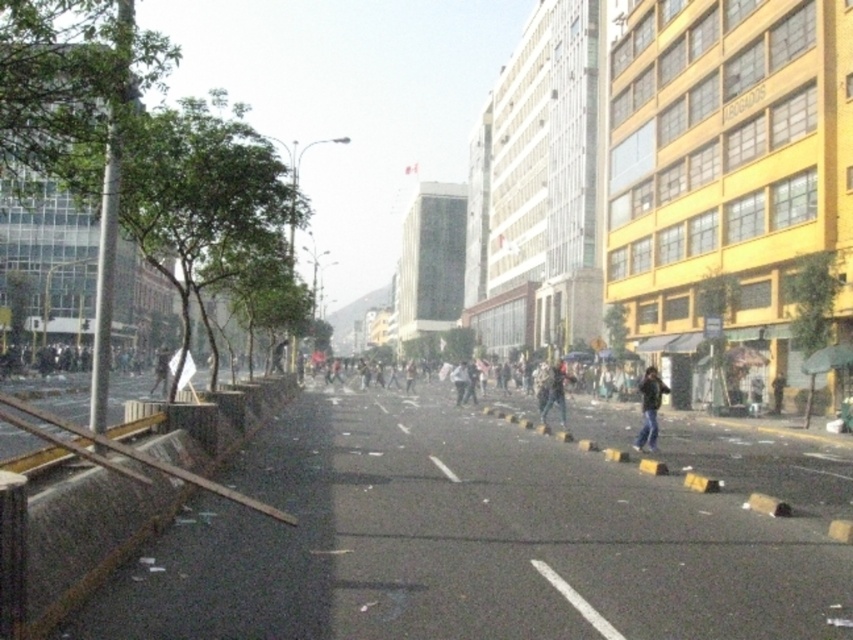
Question: Based on their relative distances, which object is farther from the wooden barricade at left?

Choices:
 (A) camouflage fabric jacket at center
 (B) dark blue jeans at lower right

Answer: (A)

Question: From the image, what is the correct spatial relationship of dark blue jeans at lower right in relation to dark gray fabric jacket at center?

Choices:
 (A) left
 (B) right

Answer: (B)

Question: Is dark blue jeans at lower right wider than camouflage fabric jacket at center?

Choices:
 (A) yes
 (B) no

Answer: (B)

Question: Can you confirm if wooden barricade at left is positioned below dark blue jeans at lower right?

Choices:
 (A) no
 (B) yes

Answer: (A)

Question: Which point appears closest to the camera in this image?

Choices:
 (A) (456, 385)
 (B) (547, 388)

Answer: (B)

Question: Among these points, which one is farthest from the camera?

Choices:
 (A) (554, 364)
 (B) (465, 392)
 (C) (91, 547)

Answer: (A)